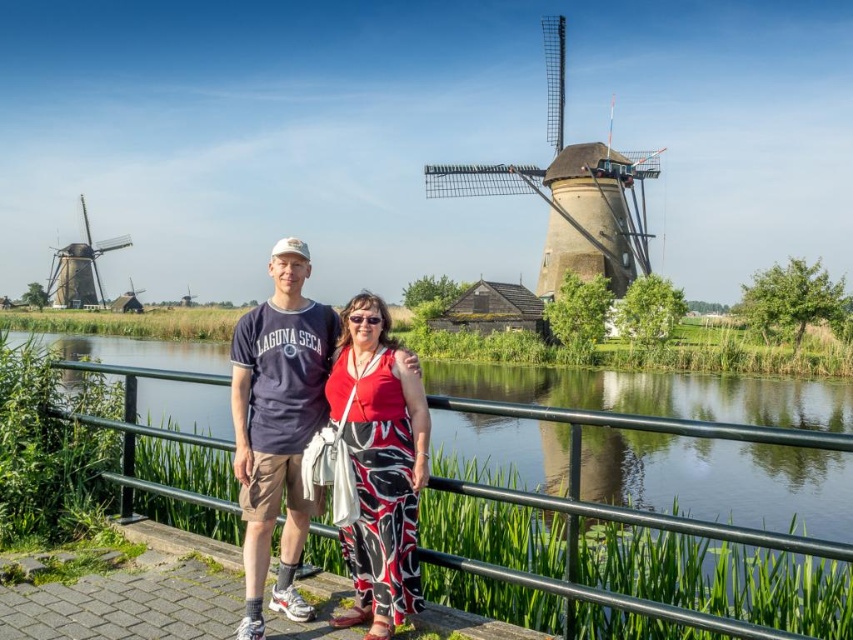
Question: Can you confirm if printed fabric couple at center is bigger than wooden windmill at left?

Choices:
 (A) yes
 (B) no

Answer: (B)

Question: Which point is farther to the camera?

Choices:
 (A) (357, 596)
 (B) (560, 148)
 (C) (67, 262)
 (D) (782, 627)

Answer: (C)

Question: Which is nearer to the printed fabric couple at center?

Choices:
 (A) wooden windmill at left
 (B) red printed pants at center
 (C) wooden windmill at upper right

Answer: (B)

Question: Is printed fabric couple at center smaller than wooden windmill at left?

Choices:
 (A) yes
 (B) no

Answer: (A)

Question: Which point is farther to the camera?

Choices:
 (A) printed fabric couple at center
 (B) red printed pants at center
 (C) green metal railing at center

Answer: (A)

Question: In this image, where is printed fabric couple at center located relative to wooden windmill at left?

Choices:
 (A) above
 (B) below

Answer: (B)